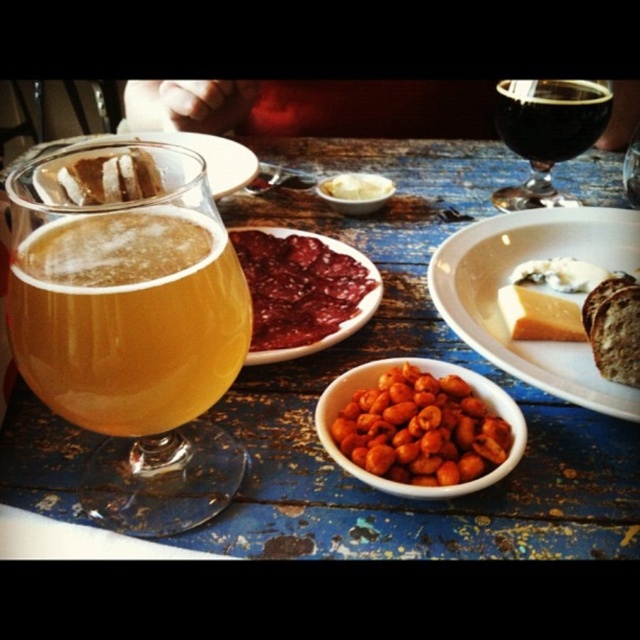
Which is more to the left, amber glass at left or orange matte nuts at center?

amber glass at left

What do you see at coordinates (131, 324) in the screenshot?
I see `amber glass at left` at bounding box center [131, 324].

At what (x,y) coordinates should I click in order to perform the action: click on amber glass at left. Please return your answer as a coordinate pair (x, y). The width and height of the screenshot is (640, 640). Looking at the image, I should click on (131, 324).

Does wooden table at center appear on the right side of orange matte nuts at center?

Correct, you'll find wooden table at center to the right of orange matte nuts at center.

Can you confirm if wooden table at center is positioned below orange matte nuts at center?

Incorrect, wooden table at center is not positioned below orange matte nuts at center.

Who is more forward, (525, 515) or (468, 474)?

Point (468, 474) is in front.

At what (x,y) coordinates should I click in order to perform the action: click on wooden table at center. Please return your answer as a coordinate pair (x, y). Looking at the image, I should click on (412, 355).

Who is higher up, white matte plate at center or white creamy spread at center?

white creamy spread at center is higher up.

Who is shorter, white matte plate at center or white creamy spread at center?

With less height is white creamy spread at center.

Who is more distant from viewer, (547, 230) or (378, 186)?

Point (378, 186)

At what (x,y) coordinates should I click in order to perform the action: click on white matte plate at center. Please return your answer as a coordinate pair (x, y). The height and width of the screenshot is (640, 640). Looking at the image, I should click on (508, 282).